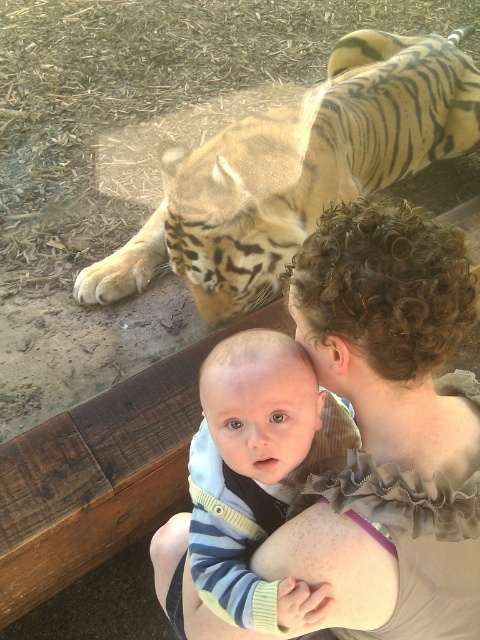
Is golden fur tiger at upper left smaller than striped knit sweater at center?

Incorrect, golden fur tiger at upper left is not smaller in size than striped knit sweater at center.

Who is positioned more to the left, golden fur tiger at upper left or striped knit sweater at center?

From the viewer's perspective, striped knit sweater at center appears more on the left side.

Measure the distance between point (222, 148) and camera.

2.00 meters

The width and height of the screenshot is (480, 640). What are the coordinates of `golden fur tiger at upper left` in the screenshot? It's located at (296, 170).

Measure the distance between curly hair at upper right and striped knit sweater at center.

A distance of 5.10 inches exists between curly hair at upper right and striped knit sweater at center.

Can you confirm if curly hair at upper right is smaller than striped knit sweater at center?

No, curly hair at upper right is not smaller than striped knit sweater at center.

Find the location of `curly hair at upper right`. curly hair at upper right is located at coordinates (389, 428).

Find the location of a particular element. The width and height of the screenshot is (480, 640). curly hair at upper right is located at coordinates (389, 428).

Who is more distant from viewer, (343, 625) or (299, 208)?

Point (299, 208)

Locate an element on the screen. This screenshot has height=640, width=480. curly hair at upper right is located at coordinates (389, 428).